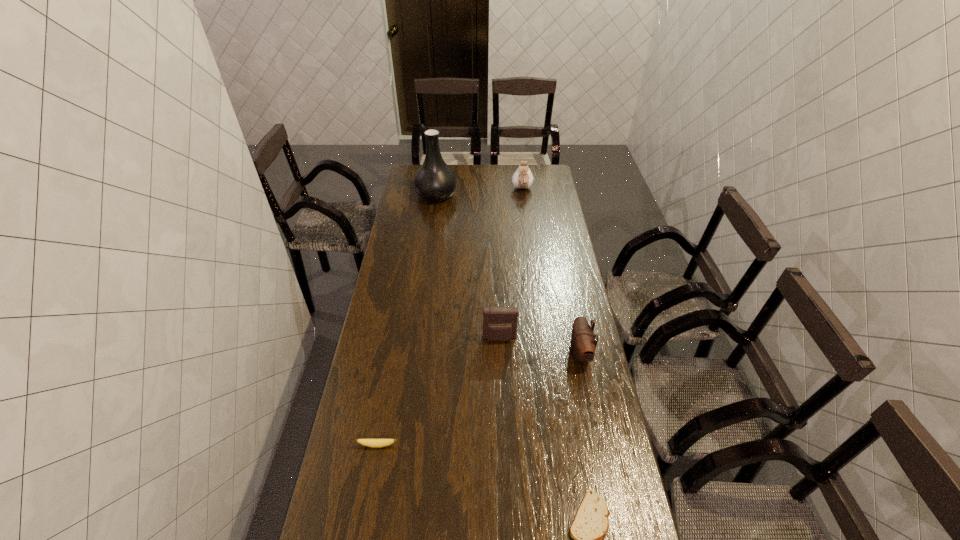
The width and height of the screenshot is (960, 540). Find the location of `vacant space located 0.180m with the flap open on the rightmost pouch`. vacant space located 0.180m with the flap open on the rightmost pouch is located at coordinates (516, 354).

Identify the location of blank area located 0.050m with the flap open on the rightmost pouch. (554, 354).

Locate an element on the screen. This screenshot has width=960, height=540. vacant space located on the back of the second nearest object is located at coordinates [x=384, y=408].

The height and width of the screenshot is (540, 960). In order to click on vase located at the far edge in this screenshot , I will do `click(434, 181)`.

Where is `pouch at the far edge`? The image size is (960, 540). pouch at the far edge is located at coordinates click(522, 178).

I want to click on vase situated at the left edge, so click(434, 181).

I want to click on banana at the left edge, so click(x=374, y=443).

Identify the location of object that is at the far left corner. The image size is (960, 540). (434, 181).

Image resolution: width=960 pixels, height=540 pixels. Find the location of `object at the far right corner`. object at the far right corner is located at coordinates point(522,178).

Find the location of a particular element. This screenshot has height=540, width=960. vacant space at the left edge is located at coordinates (399, 427).